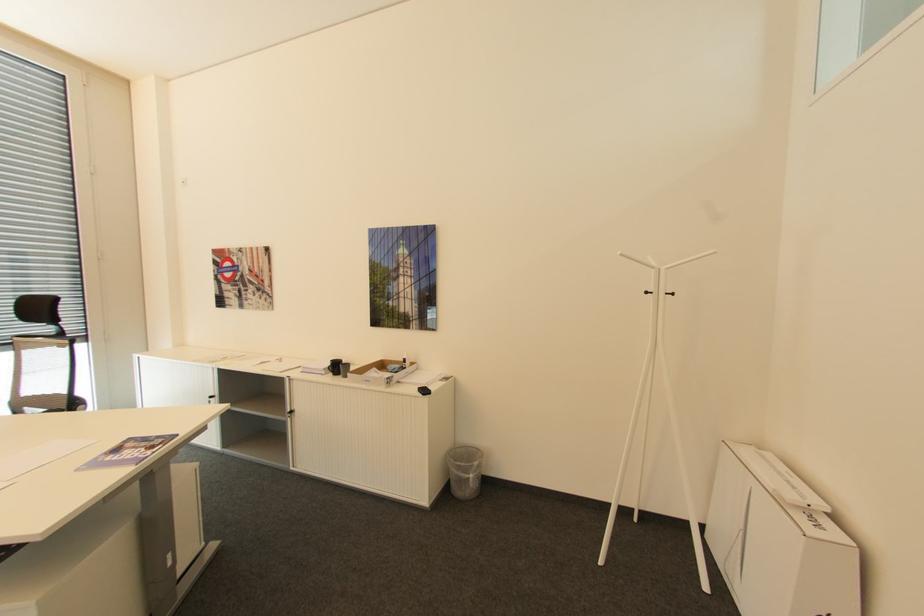
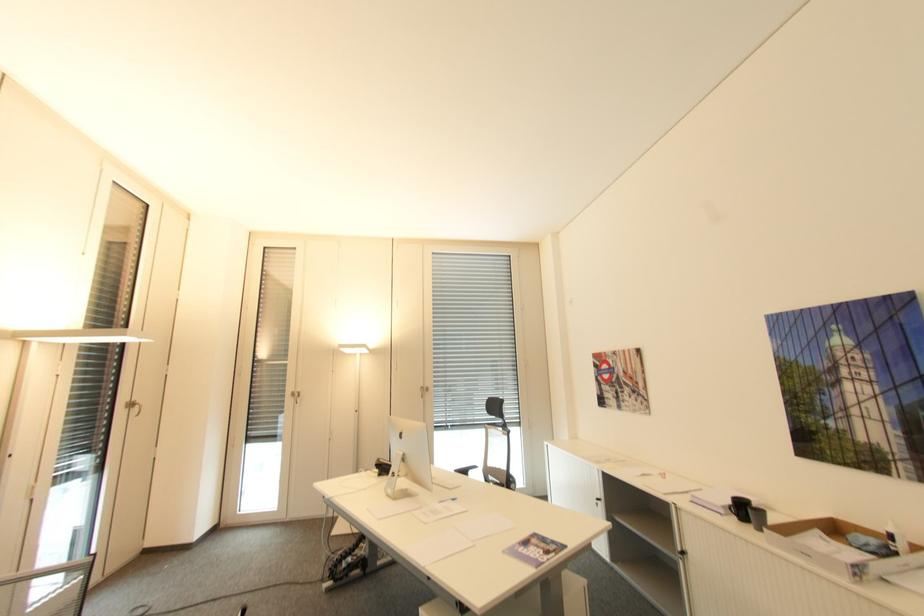
Find the pixel in the second image that matches point (351, 365) in the first image.

(766, 513)